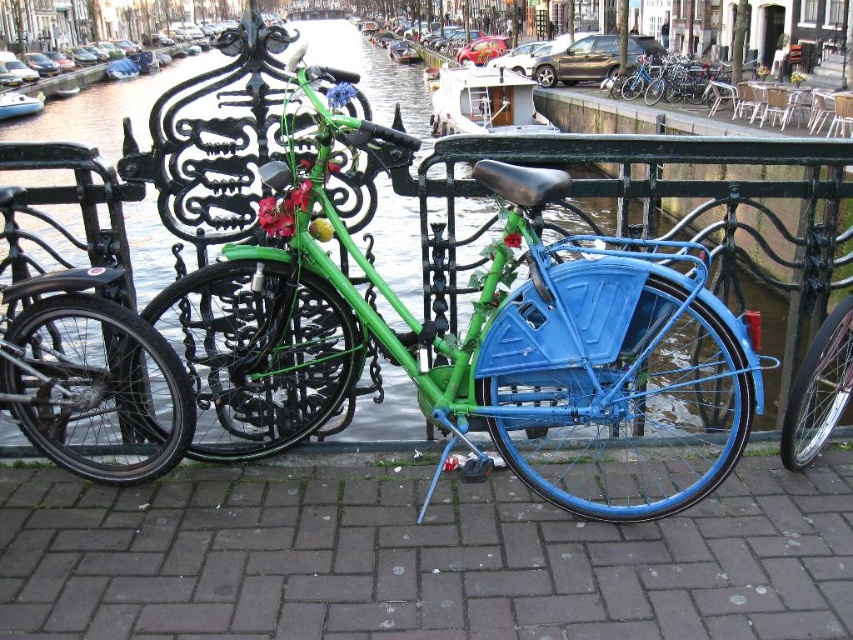
Question: Does blue rubber pavement at center have a lesser width compared to blue metallic bicycle at center?

Choices:
 (A) no
 (B) yes

Answer: (A)

Question: Is shiny black bicycle at left wider than blue metallic bicycle at center?

Choices:
 (A) no
 (B) yes

Answer: (B)

Question: Does blue rubber pavement at center have a larger size compared to blue metallic bicycle at center?

Choices:
 (A) no
 (B) yes

Answer: (B)

Question: Which point appears farthest from the camera in this image?

Choices:
 (A) (146, 356)
 (B) (186, 317)

Answer: (A)

Question: Which point is closer to the camera?

Choices:
 (A) blue metallic bicycle at center
 (B) shiny black bicycle at left

Answer: (B)

Question: Estimate the real-world distances between objects in this image. Which object is farther from the blue metallic bicycle at center?

Choices:
 (A) green matte bicycle at center
 (B) blue rubber pavement at center

Answer: (B)